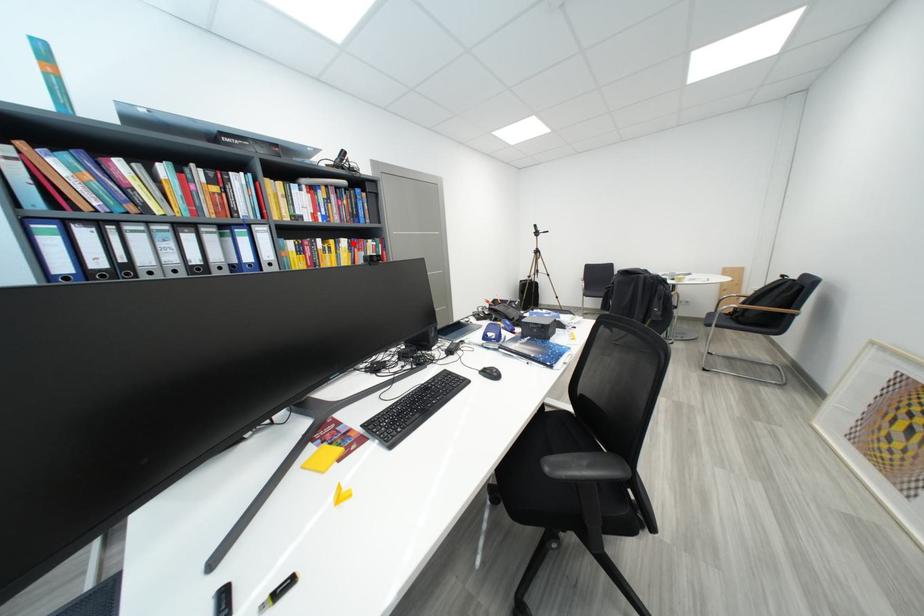
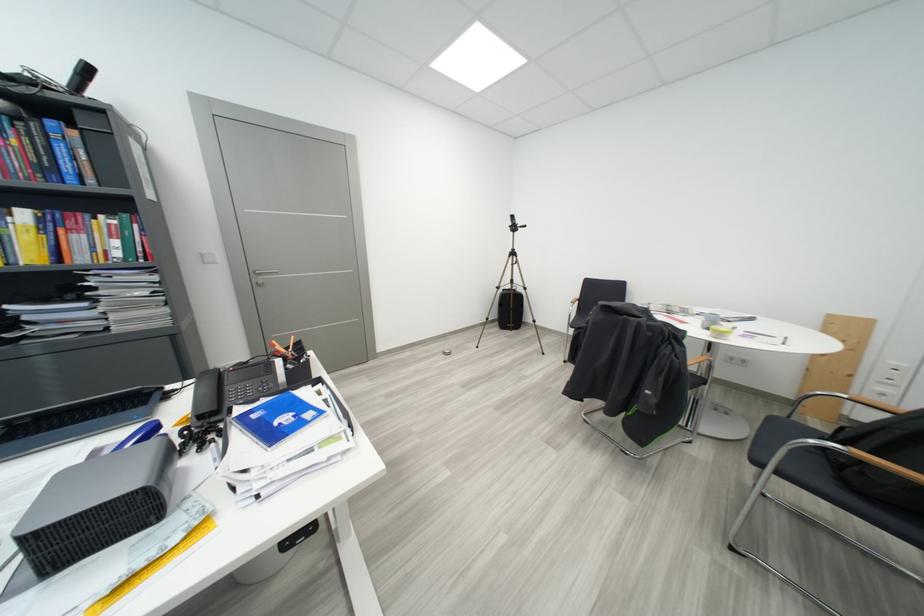
Find the pixel in the second image that matches the highlighted location in the first image.

(32, 216)